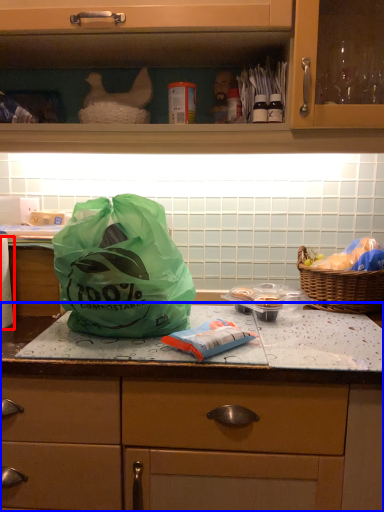
Question: Which object appears farthest to the camera in this image, toilet paper (highlighted by a red box) or countertop (highlighted by a blue box)?

Choices:
 (A) toilet paper
 (B) countertop

Answer: (A)